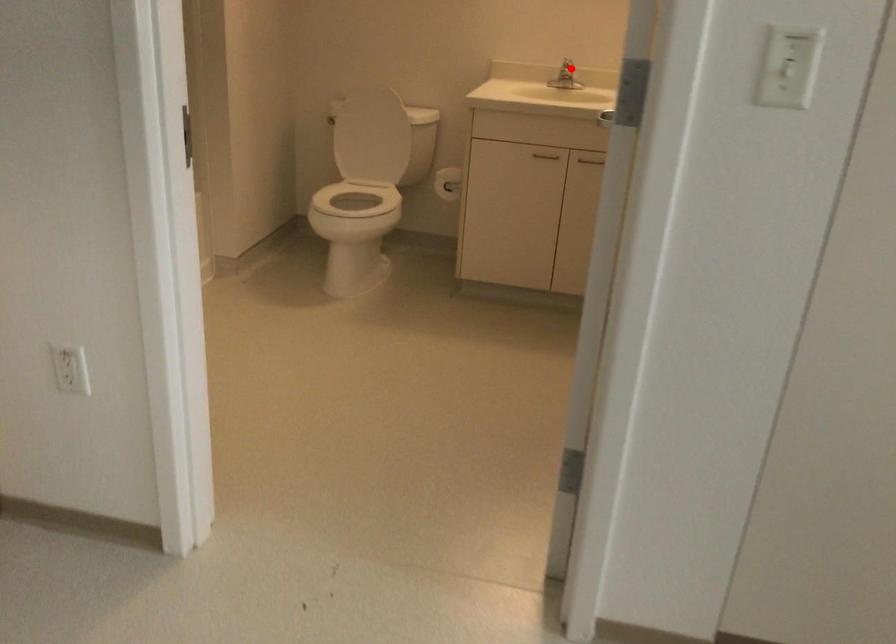
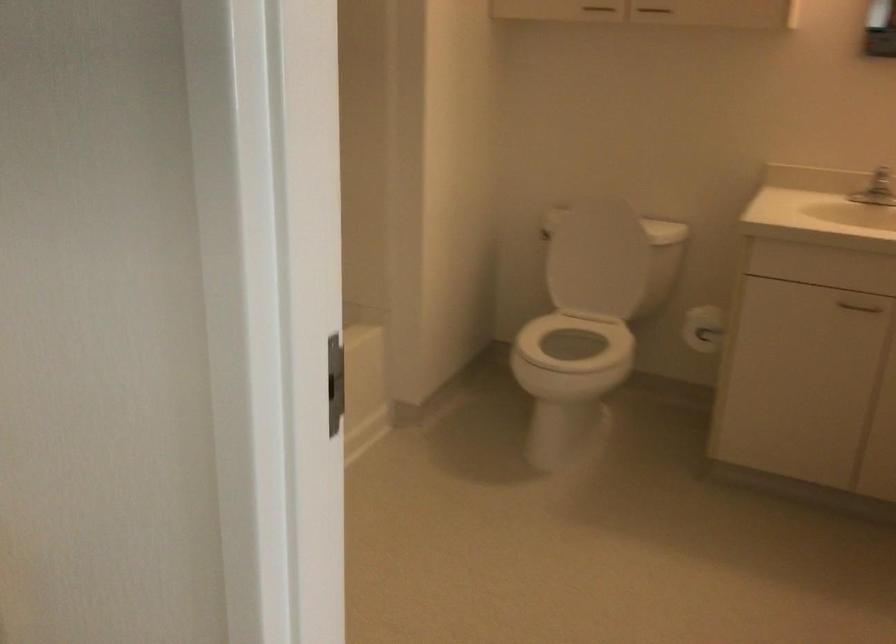
Question: A red point is marked in image1. In image2, is the corresponding 3D point closer to the camera or farther? Reply with the corresponding letter.

Choices:
 (A) The corresponding 3D point is closer.
 (B) The corresponding 3D point is farther.

Answer: (A)